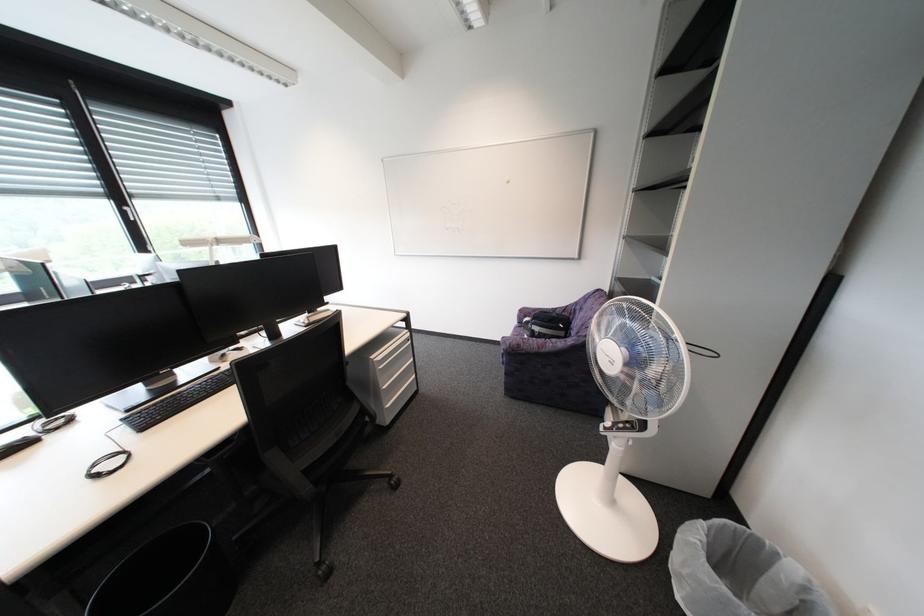
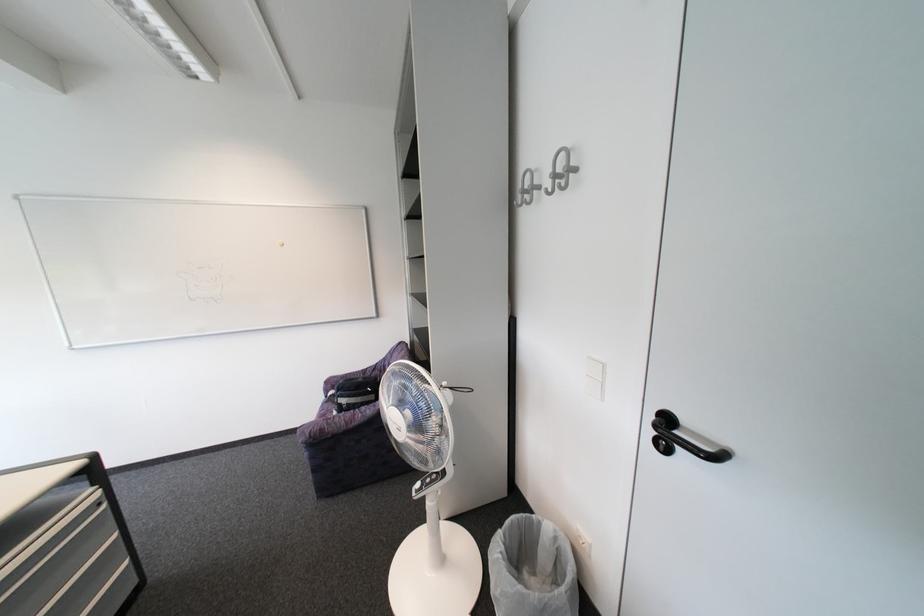
Question: The camera is either moving clockwise (left) or counter-clockwise (right) around the object. The first image is from the beginning of the video and the second image is from the end. Is the camera moving left or right when shooting the video?

Choices:
 (A) Left
 (B) Right

Answer: (A)